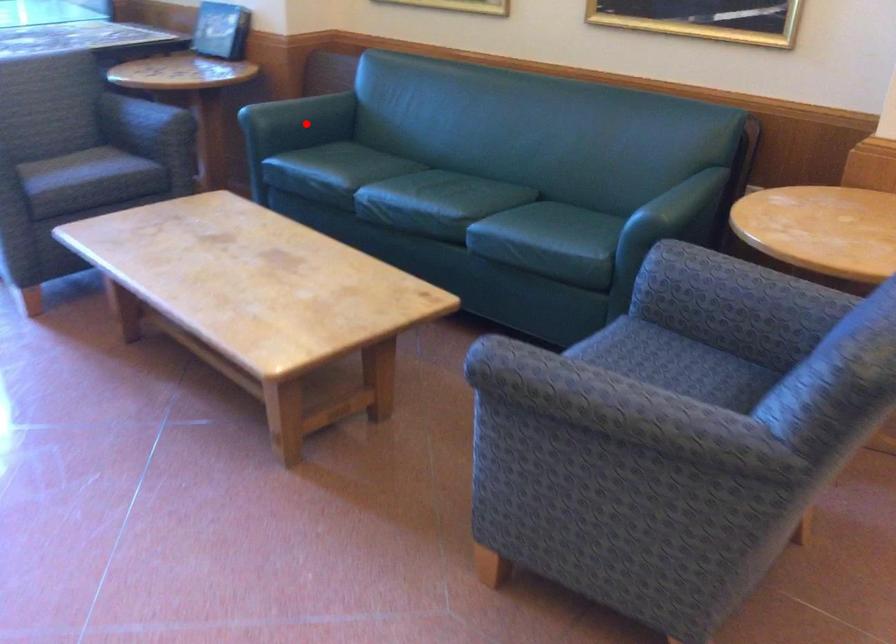
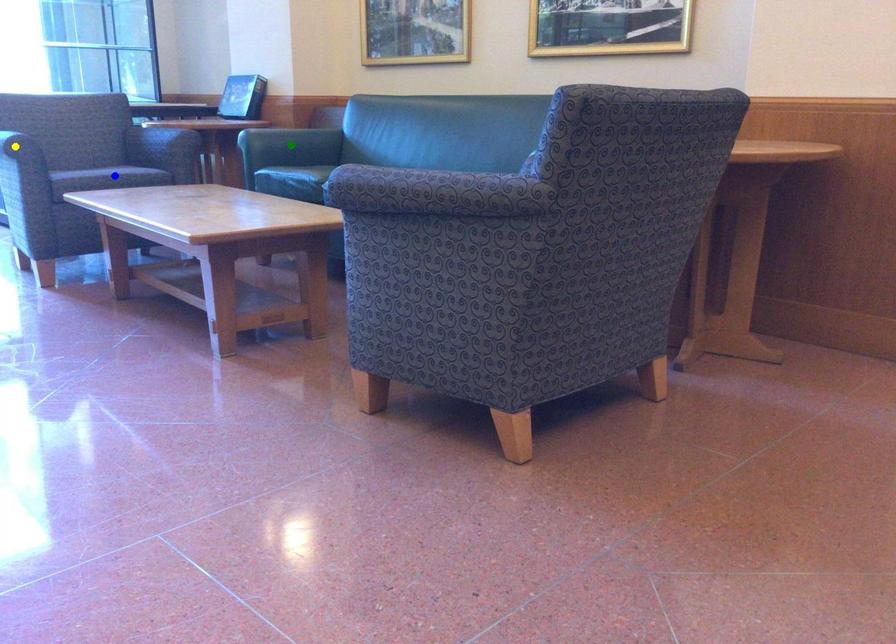
Question: I am providing you with two images of the same scene from different viewpoints. A red point is marked on the first image. You are given multiple points on the second image. Can you choose the point in image 2 that corresponds to the point in image 1?

Choices:
 (A) yellow point
 (B) blue point
 (C) green point

Answer: (C)